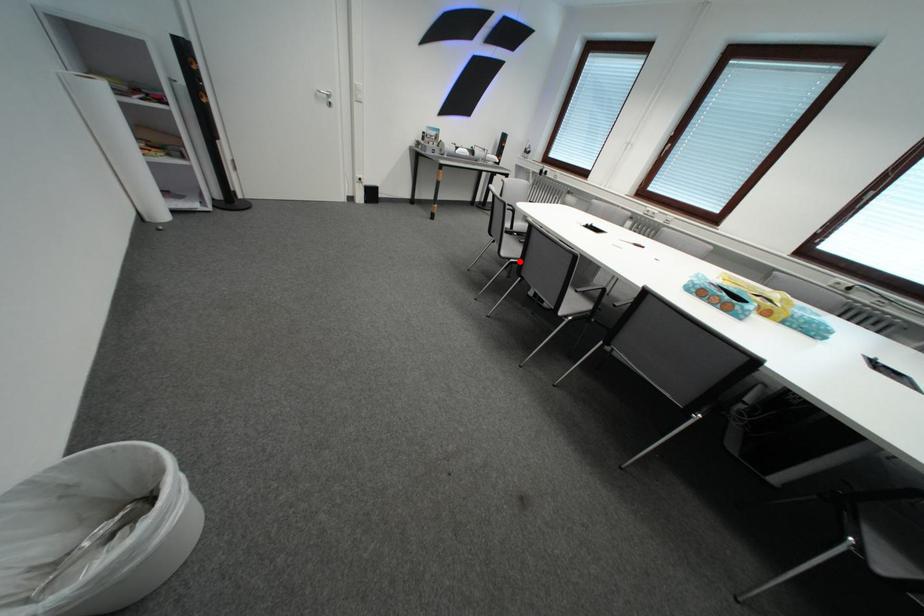
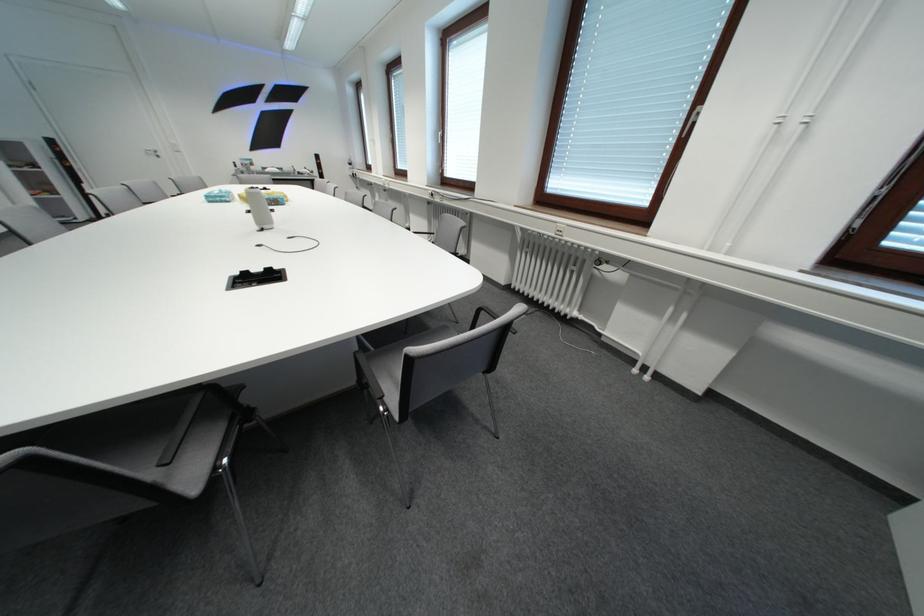
Question: I am providing you with two images of the same scene from different viewpoints. A red point is marked on the first image. Is the red point's position out of view in image 2?

Choices:
 (A) Yes
 (B) No

Answer: (A)